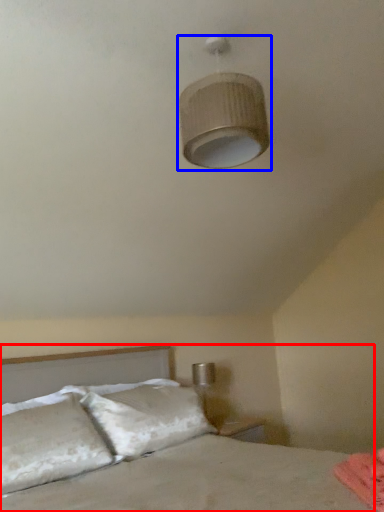
Question: Which object appears closest to the camera in this image, bed (highlighted by a red box) or lamp (highlighted by a blue box)?

Choices:
 (A) bed
 (B) lamp

Answer: (A)